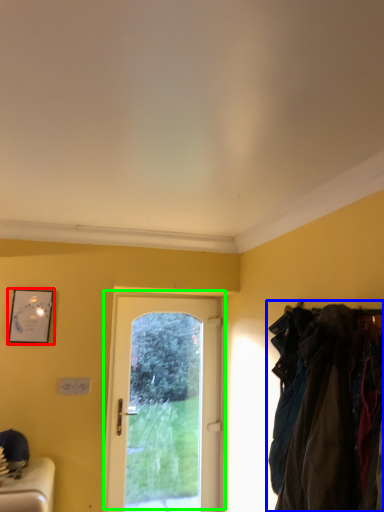
Question: Based on their relative distances, which object is nearer to picture frame (highlighted by a red box)? Choose from laundry (highlighted by a blue box) and door (highlighted by a green box).

Choices:
 (A) laundry
 (B) door

Answer: (B)